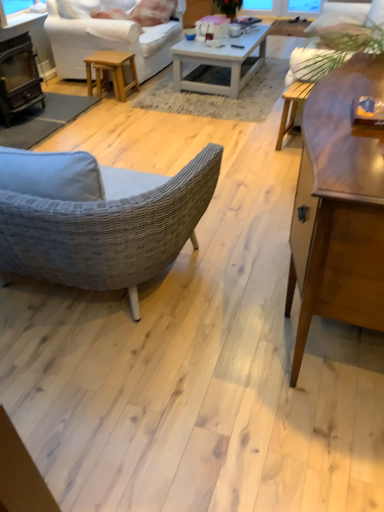
Identify the location of vacant space in front of white glossy coffee table at center, the second coffee table positioned from the bottom. (228, 103).